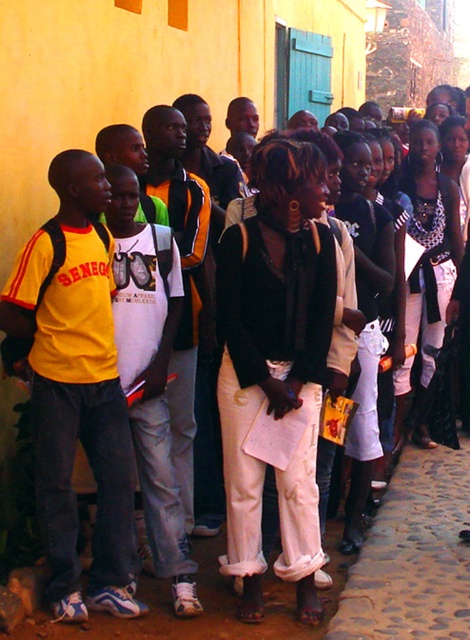
You are a photographer trying to capture a group photo of the matte black sweater at center and the yellow matte shirt at left. Since you want to ensure both subjects are clearly visible, which subject should you focus on to account for their sizes?

The matte black sweater at center has a smaller width than the yellow matte shirt at left, so you should focus on the yellow matte shirt at left to ensure it is clearly visible.

You are organizing a clothing donation drive and need to categorize items by size. You have two items to sort, the matte black sweater at center and the yellow matte shirt at left. Which item should you place in the large size bin?

The matte black sweater at center should be placed in the large size bin because it is larger in size than the yellow matte shirt at left.

You are a photographer standing 10 feet away from the group. You want to take a photo that includes both the matte black sweater at center and the yellow matte shirt at left without moving the subjects. Can you fit both in the frame if your camera has a 50mm lens? Explain your reasoning.

The distance between the matte black sweater at center and the yellow matte shirt at left is 34.98 inches. A 50mm lens has a field of view that can typically capture subjects within a 35mm distance at 10 feet, so yes, both can fit in the frame without moving the subjects.